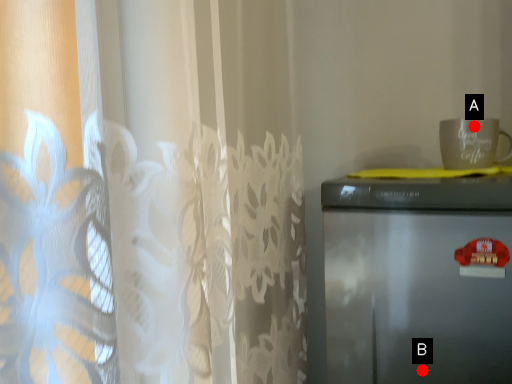
Question: Two points are circled on the image, labeled by A and B beside each circle. Which point appears closest to the camera in this image?

Choices:
 (A) A is closer
 (B) B is closer

Answer: (B)